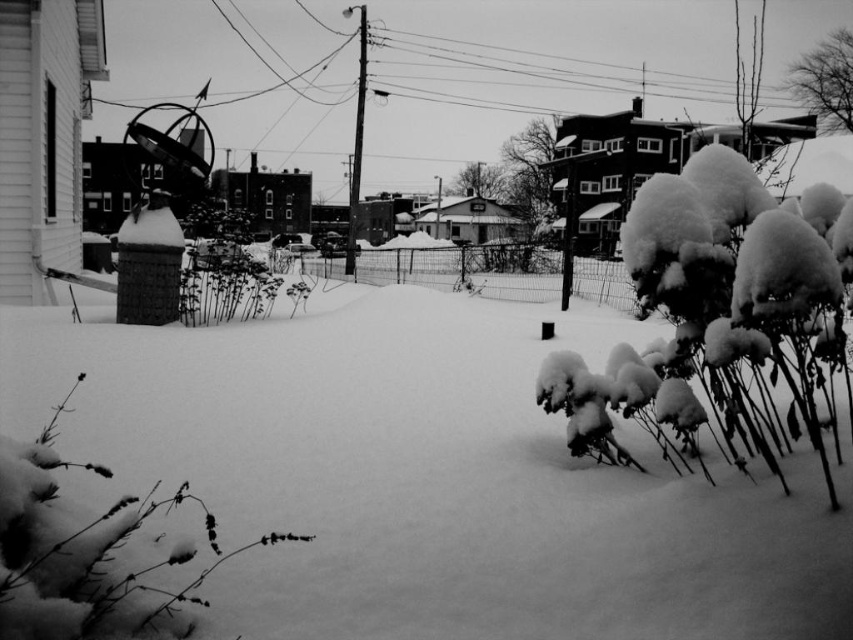
Is point (686, 413) closer to viewer compared to point (126, 534)?

No, it is behind (126, 534).

Can you confirm if fuzzy snow-covered bush at right is positioned to the right of fuzzy snow-covered plant at lower left?

Correct, you'll find fuzzy snow-covered bush at right to the right of fuzzy snow-covered plant at lower left.

Is point (791, 285) positioned behind point (125, 497)?

That is False.

Identify the location of fuzzy snow-covered bush at right. This screenshot has width=853, height=640. (717, 312).